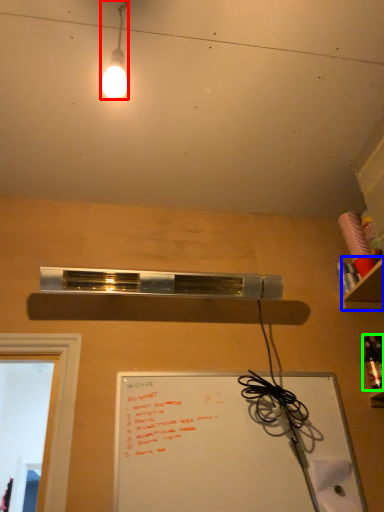
Question: Which object is the farthest from lamp (highlighted by a red box)? Choose among these: shelf (highlighted by a blue box) or bottle (highlighted by a green box).

Choices:
 (A) shelf
 (B) bottle

Answer: (B)